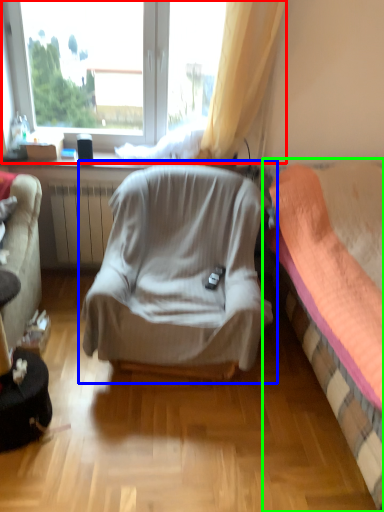
Question: Considering the real-world distances, which object is farthest from window (highlighted by a red box)? chair (highlighted by a blue box) or bed (highlighted by a green box)?

Choices:
 (A) chair
 (B) bed

Answer: (B)